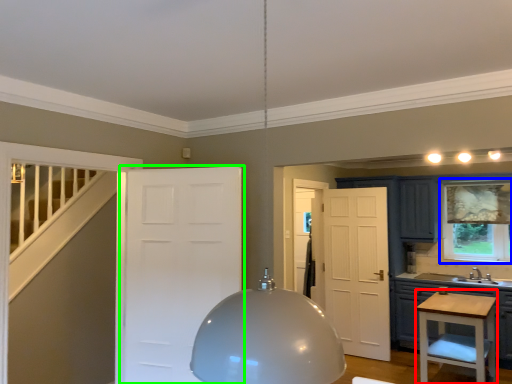
Question: Based on their relative distances, which object is farther from vanity (highlighted by a red box)? Choose from window (highlighted by a blue box) and door (highlighted by a green box).

Choices:
 (A) window
 (B) door

Answer: (B)